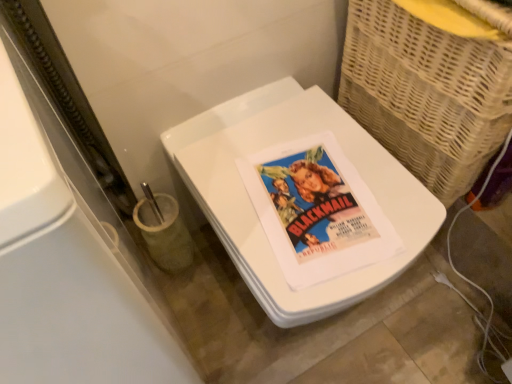
Question: From the image's perspective, does matte paper poster at center appear lower than woven wicker basket at right?

Choices:
 (A) no
 (B) yes

Answer: (B)

Question: Is matte paper poster at center beside woven wicker basket at right?

Choices:
 (A) no
 (B) yes

Answer: (A)

Question: Considering the relative sizes of matte paper poster at center and woven wicker basket at right in the image provided, is matte paper poster at center smaller than woven wicker basket at right?

Choices:
 (A) yes
 (B) no

Answer: (A)

Question: Does matte paper poster at center come in front of woven wicker basket at right?

Choices:
 (A) yes
 (B) no

Answer: (B)

Question: Is matte paper poster at center not close to woven wicker basket at right?

Choices:
 (A) yes
 (B) no

Answer: (B)

Question: Considering the relative positions of matte paper poster at center and woven wicker basket at right in the image provided, is matte paper poster at center to the right of woven wicker basket at right from the viewer's perspective?

Choices:
 (A) no
 (B) yes

Answer: (A)

Question: Is woven wicker basket at right smaller than matte paper poster at center?

Choices:
 (A) yes
 (B) no

Answer: (B)

Question: Is woven wicker basket at right behind matte paper poster at center?

Choices:
 (A) no
 (B) yes

Answer: (A)

Question: Considering the relative sizes of woven wicker basket at right and matte paper poster at center in the image provided, is woven wicker basket at right shorter than matte paper poster at center?

Choices:
 (A) no
 (B) yes

Answer: (A)

Question: Is woven wicker basket at right wider than matte paper poster at center?

Choices:
 (A) yes
 (B) no

Answer: (A)

Question: Is woven wicker basket at right outside of matte paper poster at center?

Choices:
 (A) yes
 (B) no

Answer: (A)

Question: From the image's perspective, is woven wicker basket at right above matte paper poster at center?

Choices:
 (A) no
 (B) yes

Answer: (B)

Question: Considering the relative sizes of white glossy toilet at center and woven wicker basket at right in the image provided, is white glossy toilet at center wider than woven wicker basket at right?

Choices:
 (A) no
 (B) yes

Answer: (B)